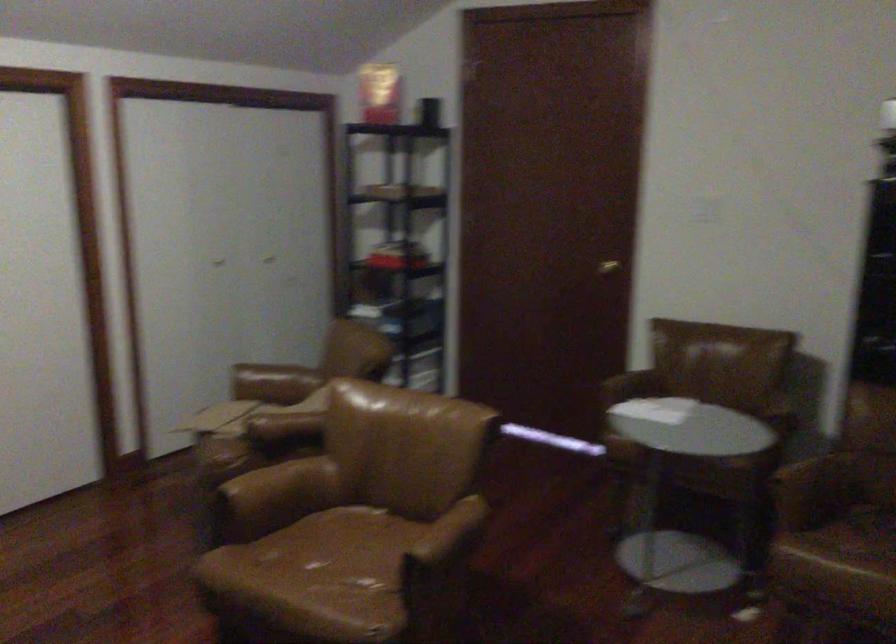
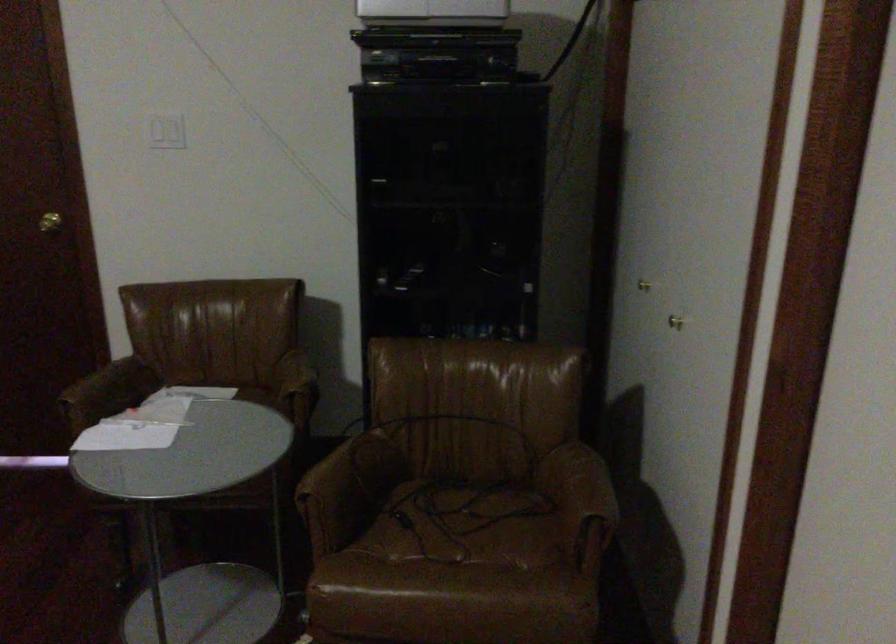
The point at (780, 491) is marked in the first image. Where is the corresponding point in the second image?

(312, 513)